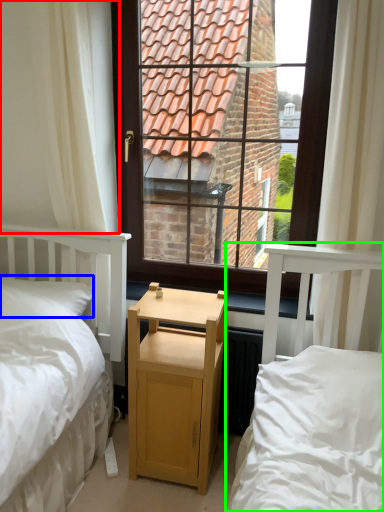
Question: Estimate the real-world distances between objects in this image. Which object is closer to curtain (highlighted by a red box), pillow (highlighted by a blue box) or bed (highlighted by a green box)?

Choices:
 (A) pillow
 (B) bed

Answer: (A)